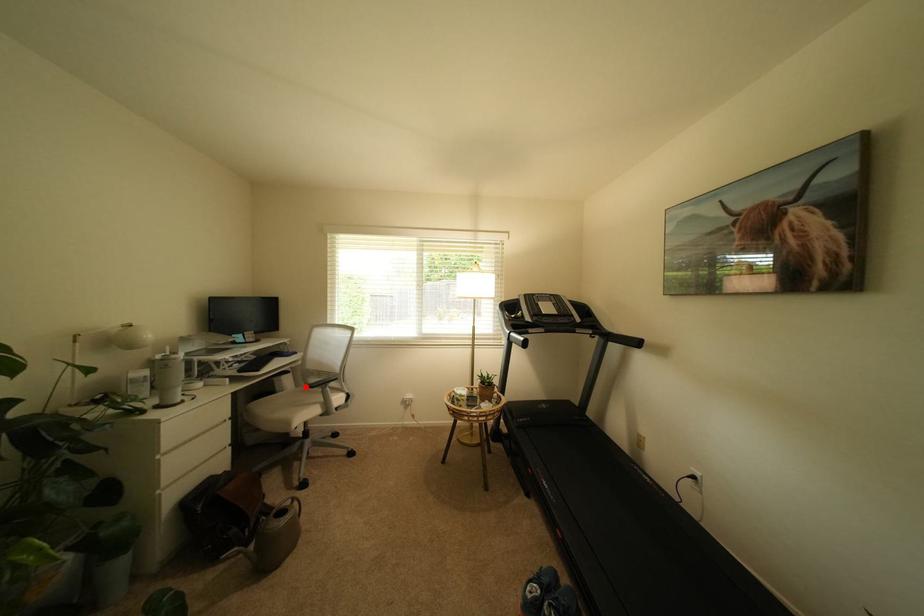
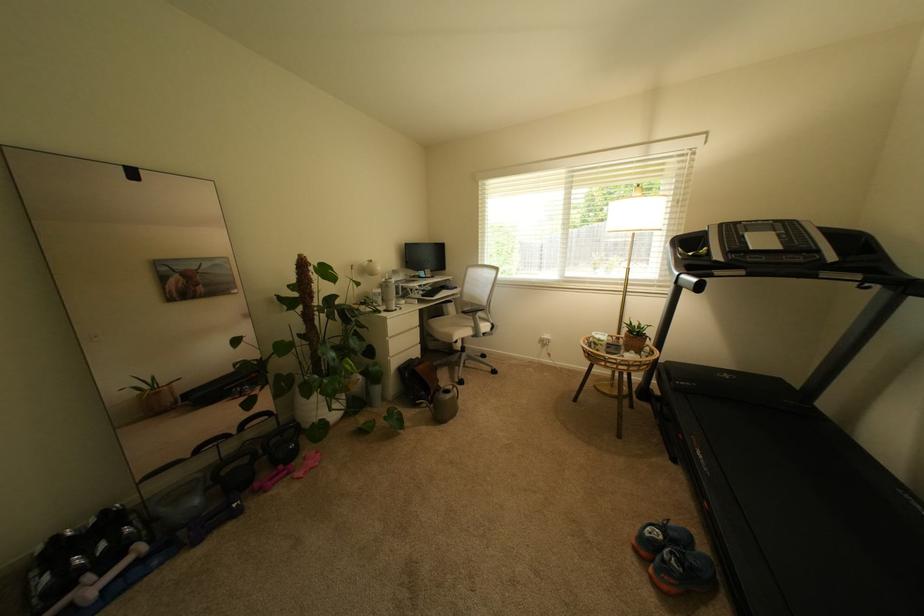
Find the pixel in the second image that matches the highlighted location in the first image.

(466, 314)